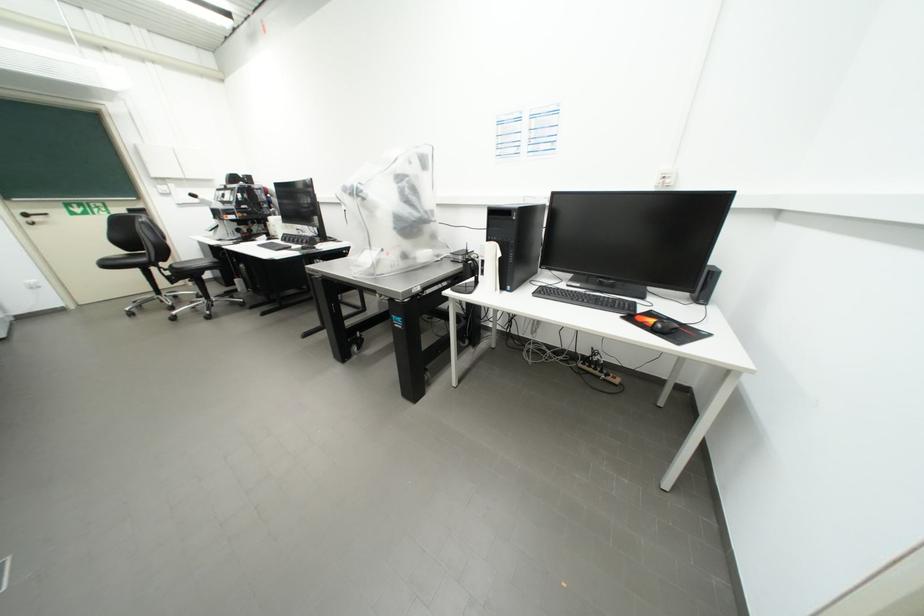
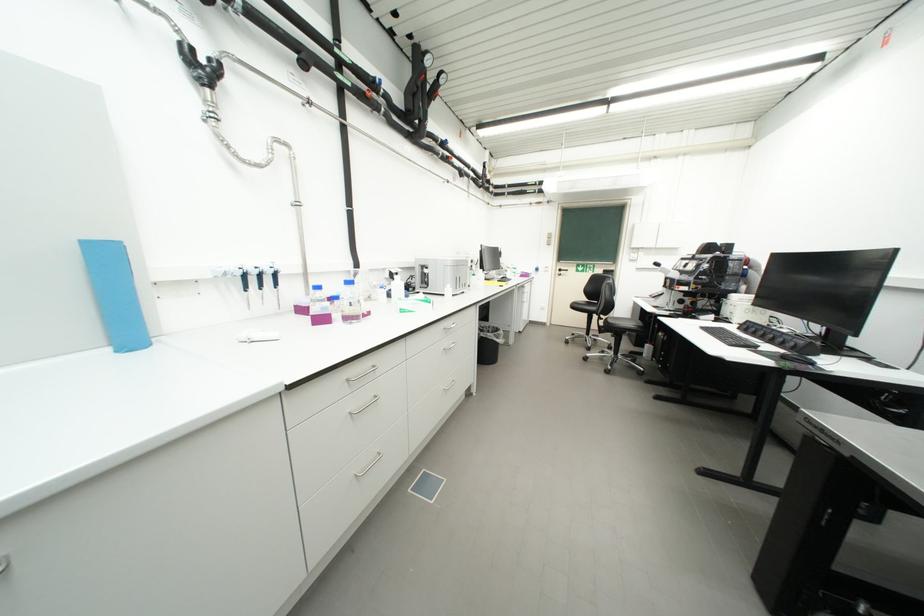
Find the pixel in the second image that matches (x=176, y=274) in the first image.

(610, 325)